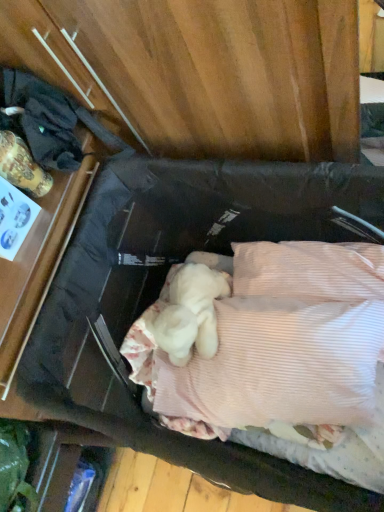
This screenshot has height=512, width=384. In order to click on white soft blanket at center in this screenshot , I will do `click(276, 343)`.

What do you see at coordinates (276, 343) in the screenshot?
I see `white soft blanket at center` at bounding box center [276, 343].

Measure the distance between point (19, 91) and camera.

Point (19, 91) and camera are 1.11 meters apart.

Measure the distance between matte black backpack at left and camera.

matte black backpack at left is 1.10 meters from camera.

Describe the element at coordinates (53, 121) in the screenshot. I see `matte black backpack at left` at that location.

Where is `matte black backpack at left`? This screenshot has height=512, width=384. matte black backpack at left is located at coordinates [x=53, y=121].

Where is `white soft blanket at center`? white soft blanket at center is located at coordinates (276, 343).

Would you say matte black backpack at left is to the left or to the right of white soft blanket at center in the picture?

matte black backpack at left is positioned on white soft blanket at center's left side.

Based on the photo, which object is more forward, matte black backpack at left or white soft blanket at center?

matte black backpack at left is closer to the camera.

Which is in front, point (64, 164) or point (295, 398)?

The point (64, 164) is closer to the camera.

In the scene shown: From the image's perspective, is matte black backpack at left above or below white soft blanket at center?

From the image's perspective, matte black backpack at left appears above white soft blanket at center.

From a real-world perspective, is matte black backpack at left physically located above or below white soft blanket at center?

In terms of real-world spatial position, matte black backpack at left is above white soft blanket at center.

Is matte black backpack at left thinner than white soft blanket at center?

Yes.

From their relative heights in the image, would you say matte black backpack at left is taller or shorter than white soft blanket at center?

Clearly, matte black backpack at left is taller compared to white soft blanket at center.

Between matte black backpack at left and white soft blanket at center, which one has smaller size?

matte black backpack at left is smaller.

Do you think matte black backpack at left is within white soft blanket at center, or outside of it?

matte black backpack at left is not inside white soft blanket at center, it's outside.

Is matte black backpack at left not close to white soft blanket at center?

That's not correct — matte black backpack at left is a little close to white soft blanket at center.

Looking at this image, is white soft blanket at center at the back of matte black backpack at left?

No, matte black backpack at left's orientation is not away from white soft blanket at center.

From the picture: How much distance is there between matte black backpack at left and white soft blanket at center?

The distance of matte black backpack at left from white soft blanket at center is 28.63 inches.

The width and height of the screenshot is (384, 512). What are the coordinates of `clothing that is on the left side of white soft blanket at center` in the screenshot? It's located at (53, 121).

Is white soft blanket at center to the right of matte black backpack at left from the viewer's perspective?

Yes.

Which object is further away from the camera, white soft blanket at center or matte black backpack at left?

white soft blanket at center is further away from the camera.

Is point (130, 337) farther from camera compared to point (106, 140)?

Yes.

From the image's perspective, is white soft blanket at center above matte black backpack at left?

No, from the image's perspective, white soft blanket at center is not over matte black backpack at left.

From a real-world perspective, does white soft blanket at center stand above matte black backpack at left?

No.

Which of these two, white soft blanket at center or matte black backpack at left, is thinner?

Thinner between the two is matte black backpack at left.

Between white soft blanket at center and matte black backpack at left, which one has less height?

white soft blanket at center.

Can you confirm if white soft blanket at center is smaller than matte black backpack at left?

Incorrect, white soft blanket at center is not smaller in size than matte black backpack at left.

Is matte black backpack at left completely or partially inside white soft blanket at center?

Actually, matte black backpack at left is outside white soft blanket at center.

Is white soft blanket at center in contact with matte black backpack at left?

No, white soft blanket at center is not with matte black backpack at left.

Is white soft blanket at center facing away from matte black backpack at left?

No, white soft blanket at center is not facing away from matte black backpack at left.

How many degrees apart are the facing directions of white soft blanket at center and matte black backpack at left?

The facing directions of white soft blanket at center and matte black backpack at left are 83.1 degrees apart.

This screenshot has width=384, height=512. In order to click on clothing above the white soft blanket at center (from a real-world perspective) in this screenshot , I will do [53, 121].

You are a GUI agent. You are given a task and a screenshot of the screen. Output one action in this format:
    pyautogui.click(x=<x>, y=<y>)
    Task: Click on the wide located behind the matte black backpack at left
    The width and height of the screenshot is (384, 512).
    Given the screenshot: What is the action you would take?
    pyautogui.click(x=276, y=343)

The image size is (384, 512). Identify the location of clothing above the white soft blanket at center (from a real-world perspective). [x=53, y=121].